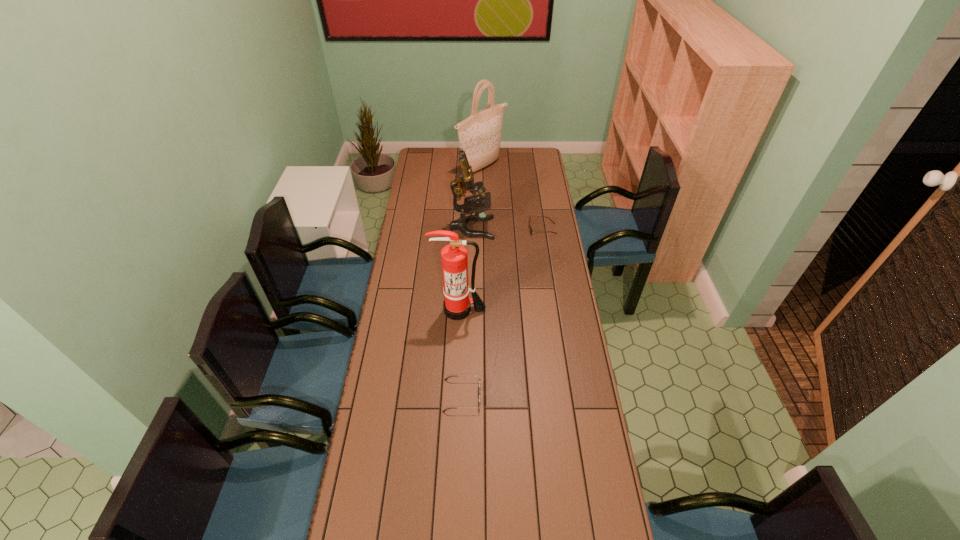
At what (x,y) coordinates should I click in order to perform the action: click on vacant space located at the nozzle of the fire extinguisher. Please return your answer as a coordinate pair (x, y). This screenshot has width=960, height=540. Looking at the image, I should click on (456, 397).

Find the location of a particular element. free space located 0.230m on the front-facing side of the farther sunglasses is located at coordinates (482, 229).

This screenshot has height=540, width=960. I want to click on vacant space located 0.260m on the front-facing side of the farther sunglasses, so click(x=475, y=229).

Where is `vacant space situated on the front-facing side of the farther sunglasses`? The image size is (960, 540). vacant space situated on the front-facing side of the farther sunglasses is located at coordinates (486, 229).

What are the coordinates of `free space located on the front-facing side of the nearest object` in the screenshot? It's located at (520, 395).

The image size is (960, 540). What are the coordinates of `object that is at the far edge` in the screenshot? It's located at (479, 135).

I want to click on object present at the right edge, so click(530, 228).

This screenshot has width=960, height=540. Find the location of `vacant space at the far edge`. vacant space at the far edge is located at coordinates (505, 160).

Where is `vacant area at the left edge of the desktop`? The image size is (960, 540). vacant area at the left edge of the desktop is located at coordinates (407, 220).

Locate an element on the screen. blank space at the right edge is located at coordinates (524, 198).